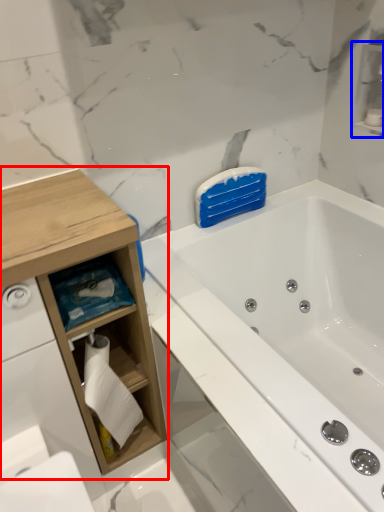
Question: Which object appears farthest to the camera in this image, cabinetry (highlighted by a red box) or cabinet (highlighted by a blue box)?

Choices:
 (A) cabinetry
 (B) cabinet

Answer: (B)